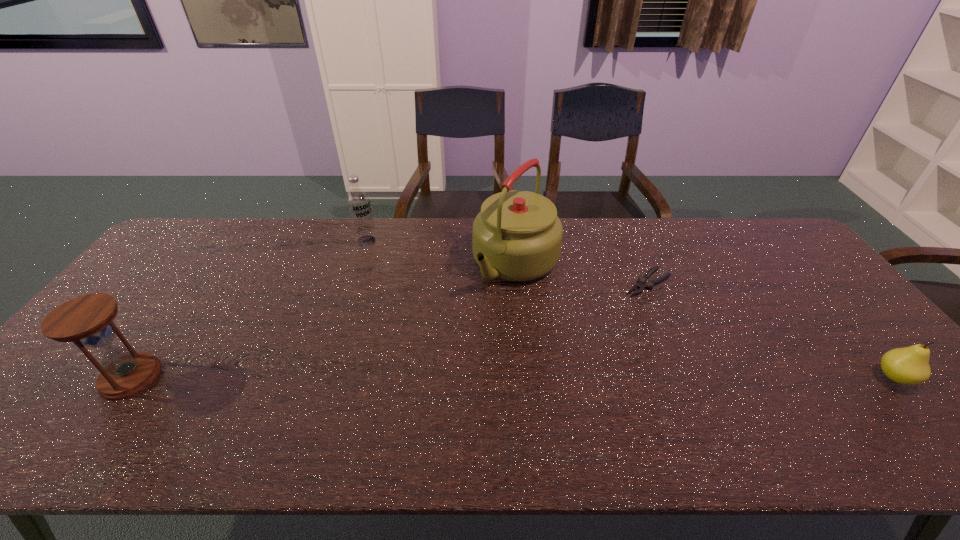
Locate an element on the screen. The height and width of the screenshot is (540, 960). vodka that is at the far edge is located at coordinates (358, 203).

The image size is (960, 540). Identify the location of hourglass at the near edge. (87, 320).

You are a GUI agent. You are given a task and a screenshot of the screen. Output one action in this format:
    pyautogui.click(x=<x>, y=<y>)
    Task: Click on the pear that is at the near edge
    
    Given the screenshot: What is the action you would take?
    pyautogui.click(x=910, y=365)

Image resolution: width=960 pixels, height=540 pixels. I want to click on object present at the left edge, so click(87, 320).

Find the location of a particular element. The width and height of the screenshot is (960, 540). object that is at the right edge is located at coordinates (910, 365).

Identify the location of object at the near left corner. The height and width of the screenshot is (540, 960). (87, 320).

At what (x,y) coordinates should I click in order to perform the action: click on object located at the near right corner. Please return your answer as a coordinate pair (x, y). Looking at the image, I should click on (910, 365).

In the image, there is a desktop. What are the coordinates of `vacant space at the far edge` in the screenshot? It's located at click(660, 245).

At what (x,y) coordinates should I click in order to perform the action: click on vacant space at the near edge of the desktop. Please return your answer as a coordinate pair (x, y). This screenshot has width=960, height=540. Looking at the image, I should click on (739, 394).

In the image, there is a desktop. Identify the location of vacant space at the right edge. This screenshot has width=960, height=540. (775, 278).